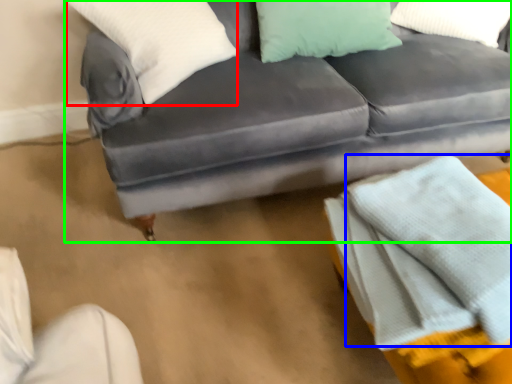
Question: Estimate the real-world distances between objects in this image. Which object is closer to pillow (highlighted by a red box), blanket (highlighted by a blue box) or studio couch (highlighted by a green box)?

Choices:
 (A) blanket
 (B) studio couch

Answer: (B)